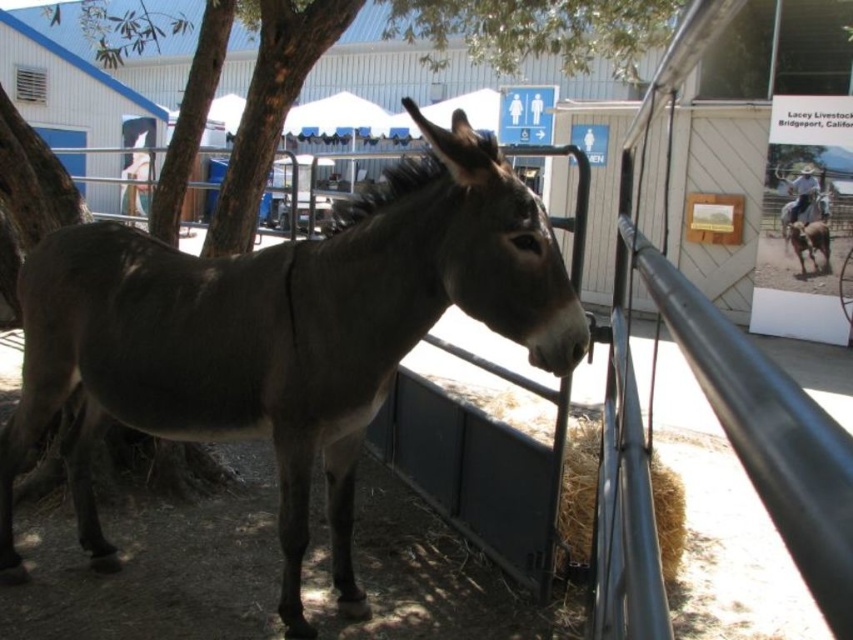
Question: Which point is closer to the camera?

Choices:
 (A) (80, 362)
 (B) (428, 28)

Answer: (A)

Question: Does green leafy tree at upper left have a greater width compared to light brown straw at lower center?

Choices:
 (A) no
 (B) yes

Answer: (A)

Question: Among these points, which one is farthest from the camera?

Choices:
 (A) (682, 483)
 (B) (403, 29)

Answer: (B)

Question: Does gray matte mule at center have a greater width compared to light brown straw at lower center?

Choices:
 (A) no
 (B) yes

Answer: (B)

Question: Which point is closer to the camera taking this photo?

Choices:
 (A) pos(317,8)
 (B) pos(672,468)

Answer: (B)

Question: From the image, what is the correct spatial relationship of gray matte mule at center in relation to green leafy tree at upper left?

Choices:
 (A) left
 (B) right

Answer: (B)